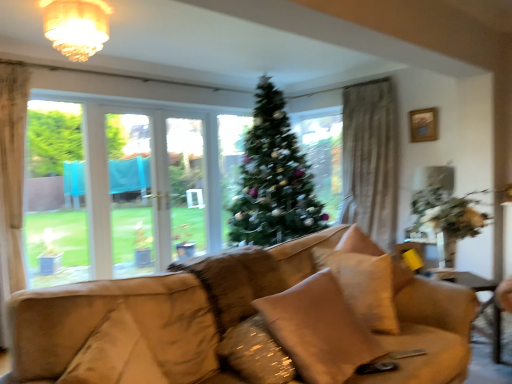
Question: Which is correct: wooden picture frame at upper right is inside beige fabric pillow at center, the 1th pillow in the back-to-front sequence, or outside of it?

Choices:
 (A) inside
 (B) outside

Answer: (B)

Question: Considering the positions of wooden picture frame at upper right and beige fabric pillow at center, placed as the third pillow when sorted from front to back, in the image, is wooden picture frame at upper right wider or thinner than beige fabric pillow at center, placed as the third pillow when sorted from front to back,?

Choices:
 (A) thin
 (B) wide

Answer: (A)

Question: Based on their relative distances, which object is farther from the green matte christmas tree at center?

Choices:
 (A) beige fabric pillow at center, which appears as the 1th pillow when viewed from the front
 (B) beige fabric pillow at center, the 2th pillow viewed from the back
 (C) wooden picture frame at upper right
 (D) matte glass chandelier at upper center
 (E) beige fabric pillow at center, the 1th pillow in the back-to-front sequence

Answer: (B)

Question: Estimate the real-world distances between objects in this image. Which object is farther from the beige fabric pillow at center, the second pillow when ordered from front to back?

Choices:
 (A) matte glass chandelier at upper center
 (B) wooden picture frame at upper right
 (C) beige fabric pillow at center, placed as the third pillow when sorted from front to back
 (D) green matte christmas tree at center
 (E) suede tan swivel chair at lower left

Answer: (B)